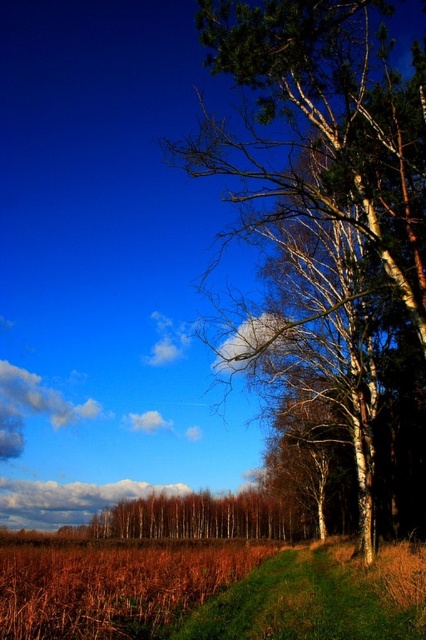
Question: Does brown dry grass at lower left have a smaller size compared to green grass at lower right?

Choices:
 (A) yes
 (B) no

Answer: (B)

Question: Among these points, which one is nearest to the camera?

Choices:
 (A) (13, 560)
 (B) (310, 29)

Answer: (B)

Question: Can you confirm if smooth white bark tree at right is positioned to the right of brown dry grass at lower left?

Choices:
 (A) no
 (B) yes

Answer: (B)

Question: Among these objects, which one is nearest to the camera?

Choices:
 (A) smooth white bark tree at right
 (B) green grass at lower right
 (C) brown dry grass at lower left

Answer: (C)

Question: Is smooth white bark tree at right above brown dry grass at lower left?

Choices:
 (A) no
 (B) yes

Answer: (B)

Question: Which object is closer to the camera taking this photo?

Choices:
 (A) brown dry grass at lower left
 (B) smooth white bark tree at right

Answer: (A)